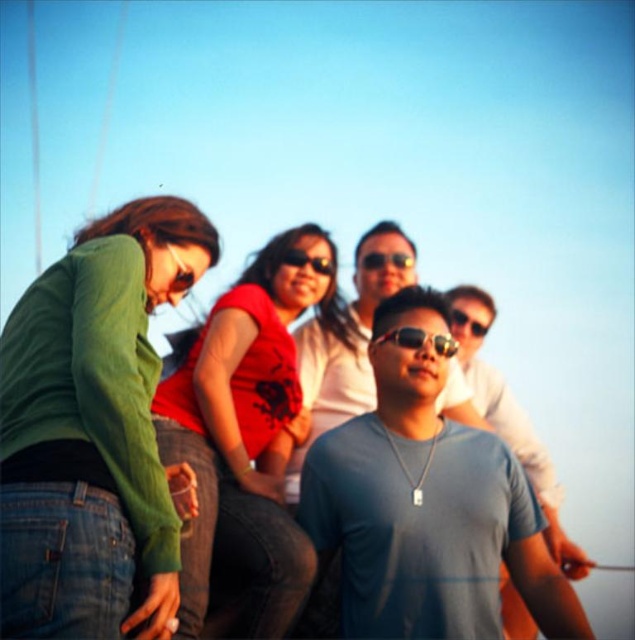
You are standing in the scene and want to move from point A to point B. Point A is at coordinate point (406, 330) and point B is at coordinate point (474, 332). Which point is closer to you?

Point A at coordinate point (406, 330) is closer to you than point B at coordinate point (474, 332).

Consider the image. You are taking a photo of the matte red shirt at center and the sunglasses at center. Which object is positioned closer to the camera?

The matte red shirt at center is closer to the viewer than the sunglasses at center, so the matte red shirt at center is positioned closer to the camera.